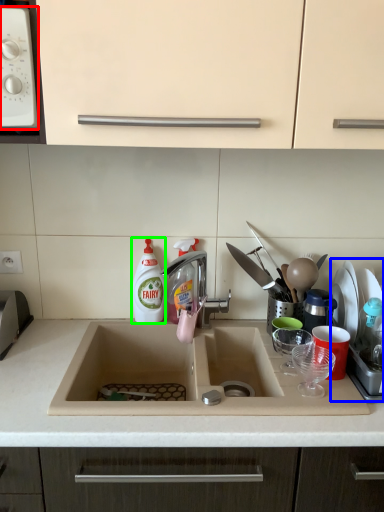
Question: Which object is positioned farthest from home appliance (highlighted by a red box)? Select from appliance (highlighted by a blue box) and cleaning product (highlighted by a green box).

Choices:
 (A) appliance
 (B) cleaning product

Answer: (A)